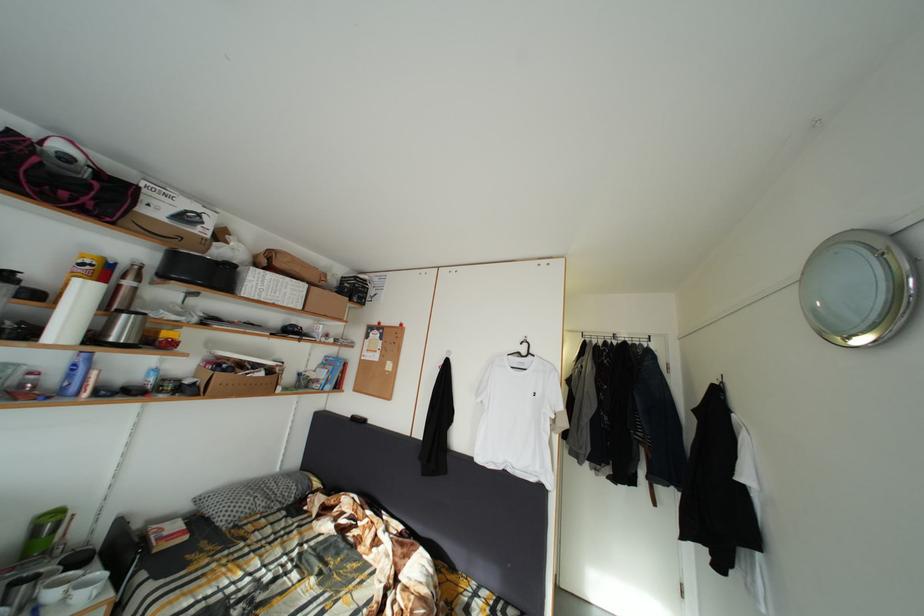
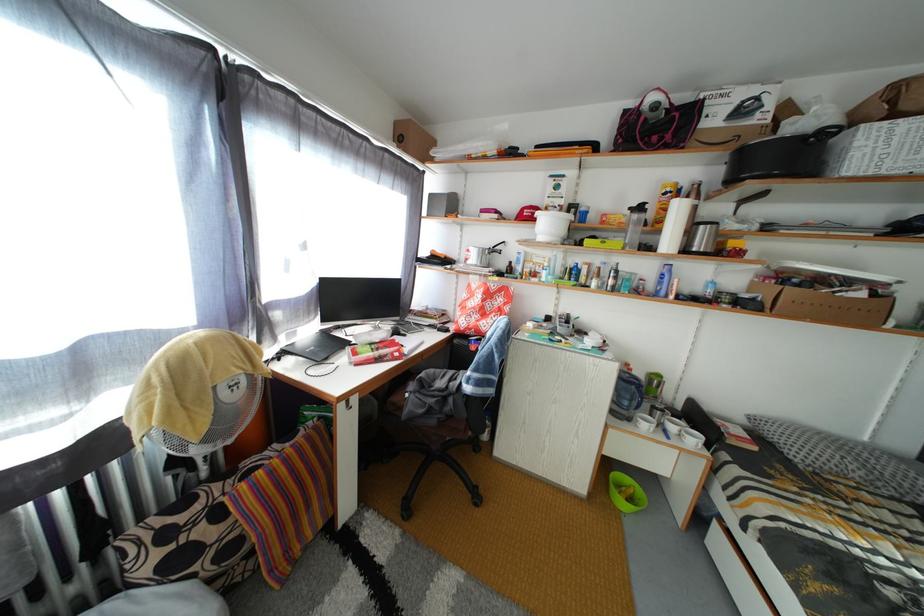
Question: The camera is either moving clockwise (left) or counter-clockwise (right) around the object. The first image is from the beginning of the video and the second image is from the end. Is the camera moving left or right when shooting the video?

Choices:
 (A) Left
 (B) Right

Answer: (B)